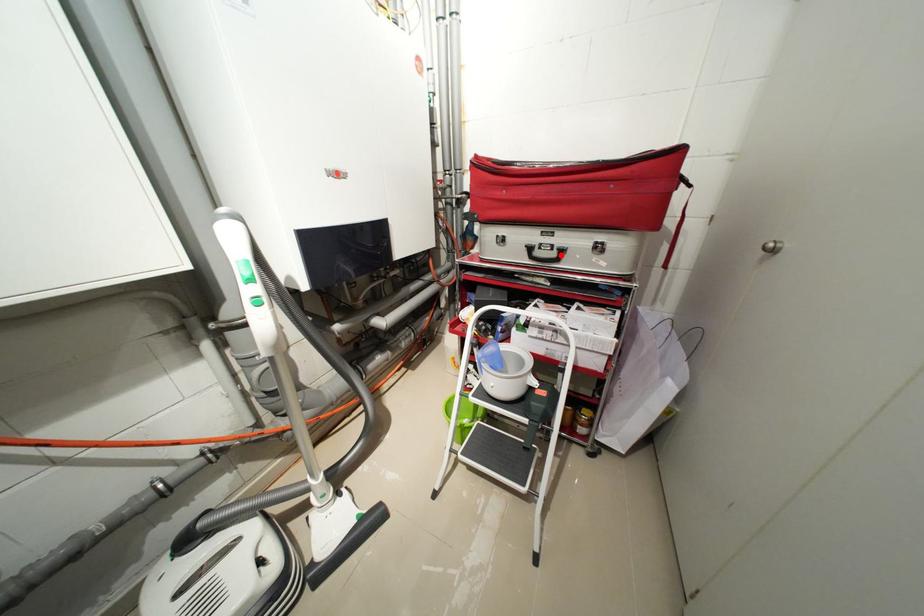
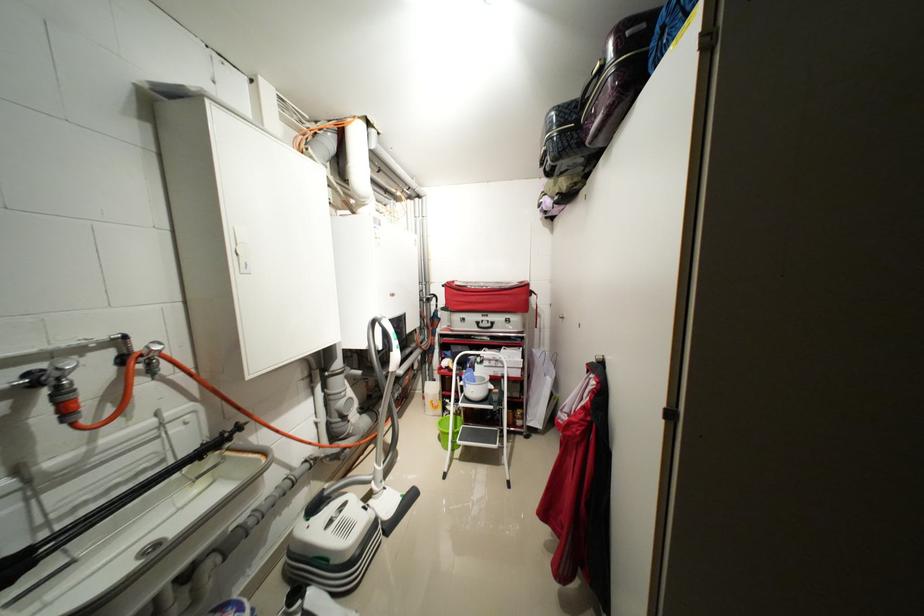
The point at the highlighted location is marked in the first image. Where is the corresponding point in the second image?

(496, 326)